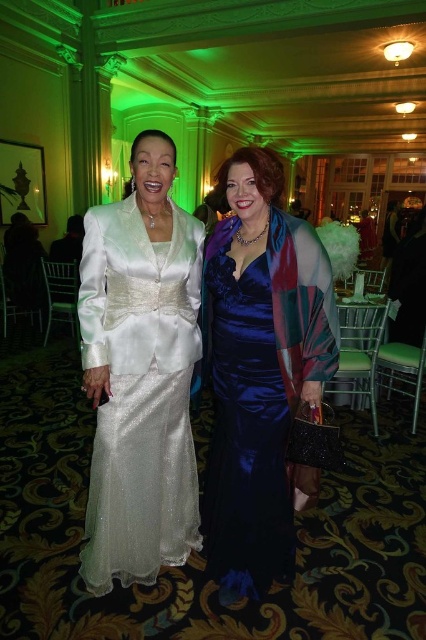
Does satin white suit at center have a lesser width compared to satin blue dress at center?

In fact, satin white suit at center might be wider than satin blue dress at center.

Is point (155, 163) positioned behind point (313, 276)?

Yes, it is.

Find the location of `satin white suit at center`. satin white suit at center is located at coordinates (141, 372).